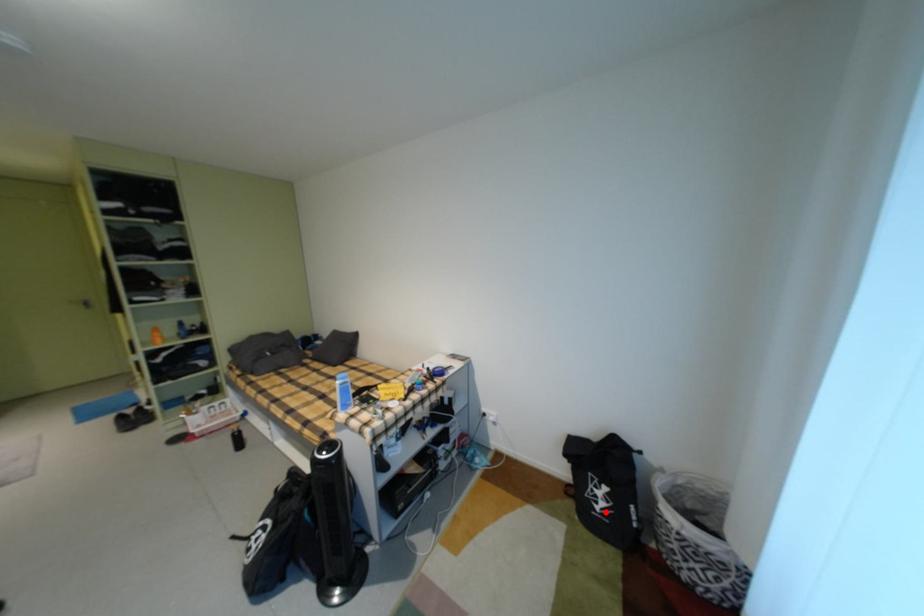
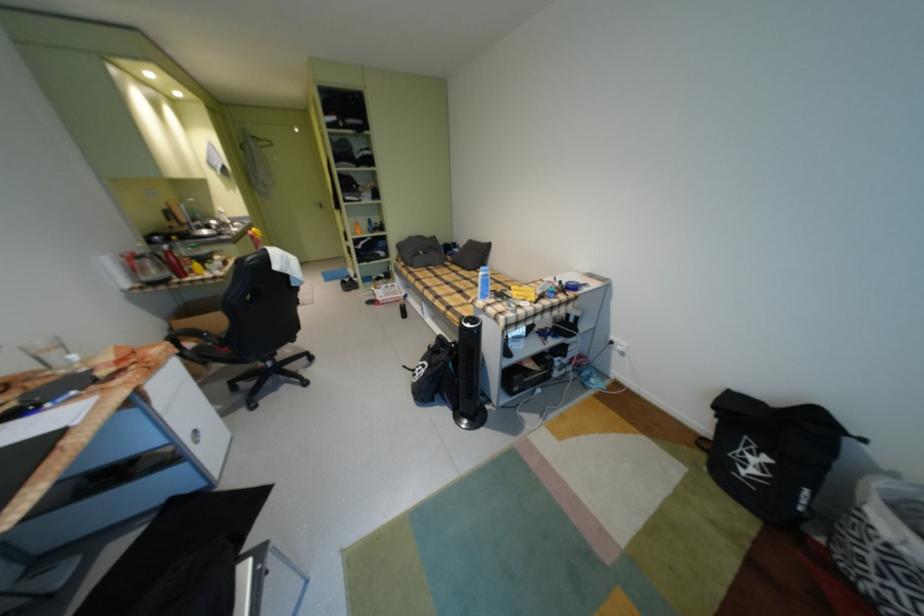
Question: I am providing you with two images of the same scene from different viewpoints. Given a red point in image1, look at the same physical point in image2. Is it:

Choices:
 (A) Closer to the viewpoint
 (B) Farther from the viewpoint

Answer: (A)